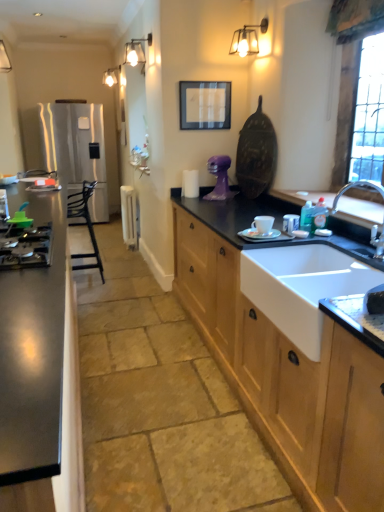
Where is `vacant area on top of shiny metallic gas stove at left (from a real-world perspective)`? This screenshot has height=512, width=384. vacant area on top of shiny metallic gas stove at left (from a real-world perspective) is located at coordinates (23, 232).